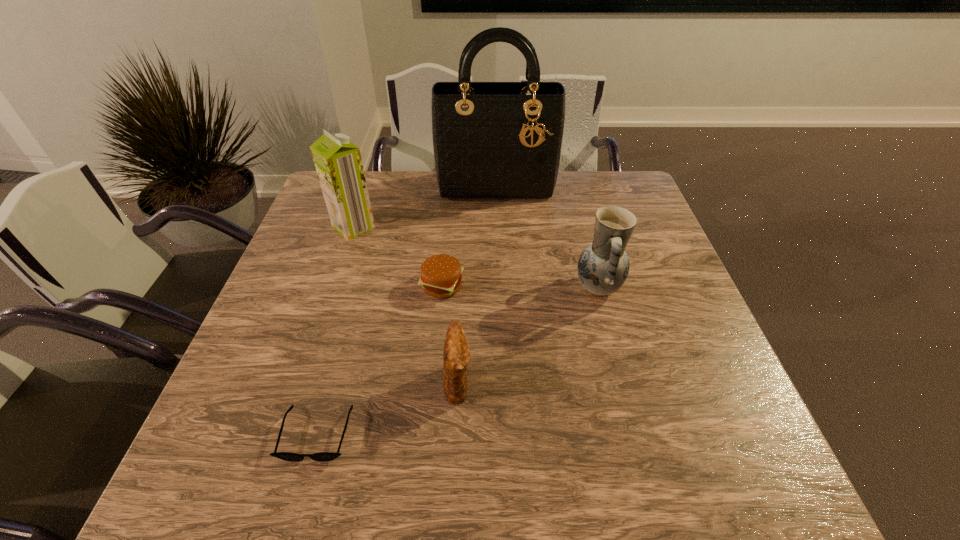
At what (x,y) coordinates should I click in order to perform the action: click on free space located at the front of the farthest object with visible charms. Please return your answer as a coordinate pair (x, y). Looking at the image, I should click on (501, 280).

At what (x,y) coordinates should I click in order to perform the action: click on free space located 0.310m on the front of the soya milk. Please return your answer as a coordinate pair (x, y). Looking at the image, I should click on (320, 327).

Find the location of a particular element. free spot located on either side of the fourth shortest object is located at coordinates (550, 287).

Locate an element on the screen. This screenshot has width=960, height=540. free point located on either side of the fourth shortest object is located at coordinates (497, 287).

Locate an element on the screen. free space located on either side of the fourth shortest object is located at coordinates (424, 287).

Where is `vacant region located 0.380m on the open side of the second nearest object`? This screenshot has width=960, height=540. vacant region located 0.380m on the open side of the second nearest object is located at coordinates (659, 382).

Locate an element on the screen. This screenshot has width=960, height=540. vacant space located on the front of the hamburger is located at coordinates tap(437, 353).

Identify the location of handbag that is at the far edge. (497, 141).

Where is `soya milk present at the far edge`? This screenshot has height=540, width=960. soya milk present at the far edge is located at coordinates (338, 162).

This screenshot has height=540, width=960. What are the coordinates of `object positioned at the near edge` in the screenshot? It's located at (287, 456).